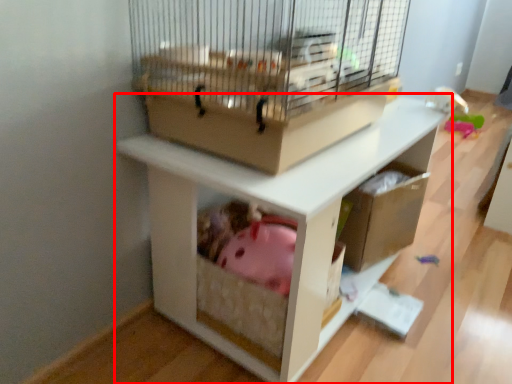
Question: From the image, what is the correct spatial relationship of shelf (annotated by the red box) in relation to bird cage?

Choices:
 (A) right
 (B) left

Answer: (A)